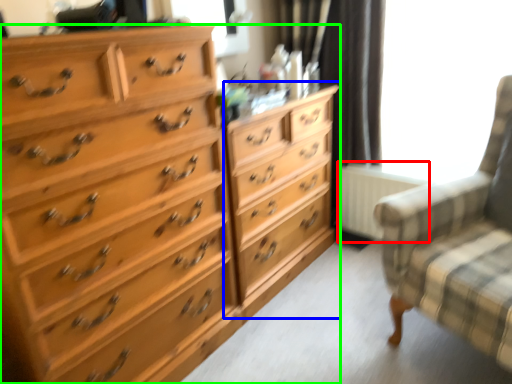
Question: Which is farther away from radiator (highlighted by a red box)? dresser (highlighted by a blue box) or chest of drawers (highlighted by a green box)?

Choices:
 (A) dresser
 (B) chest of drawers

Answer: (B)